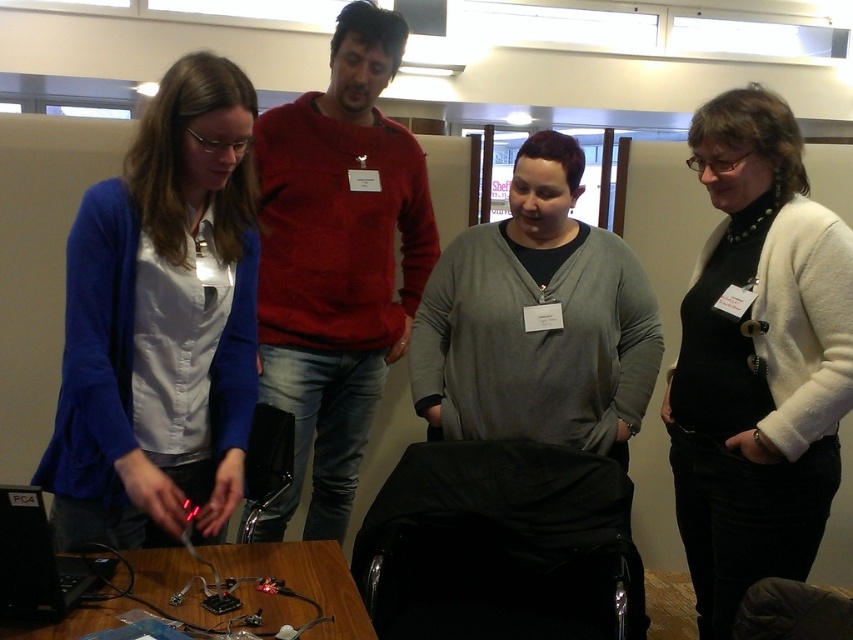
Question: Which point is closer to the camera?

Choices:
 (A) (637, 344)
 (B) (370, 125)
 (C) (172, 493)

Answer: (C)

Question: Which object appears farthest from the camera in this image?

Choices:
 (A) wooden table at lower left
 (B) red sweater at center
 (C) blue fabric shirt at center
 (D) black plastic computer at lower left

Answer: (B)

Question: Observing the image, what is the correct spatial positioning of blue fabric shirt at center in reference to red sweater at center?

Choices:
 (A) left
 (B) right

Answer: (A)

Question: Which of these objects is positioned closest to the white wool sweater at upper right?

Choices:
 (A) blue fabric shirt at center
 (B) wooden table at lower left
 (C) black plastic computer at lower left
 (D) gray matte sweater at center

Answer: (D)

Question: Is blue fabric shirt at center below gray matte sweater at center?

Choices:
 (A) yes
 (B) no

Answer: (A)

Question: Can you confirm if white wool sweater at upper right is thinner than red sweater at center?

Choices:
 (A) yes
 (B) no

Answer: (A)